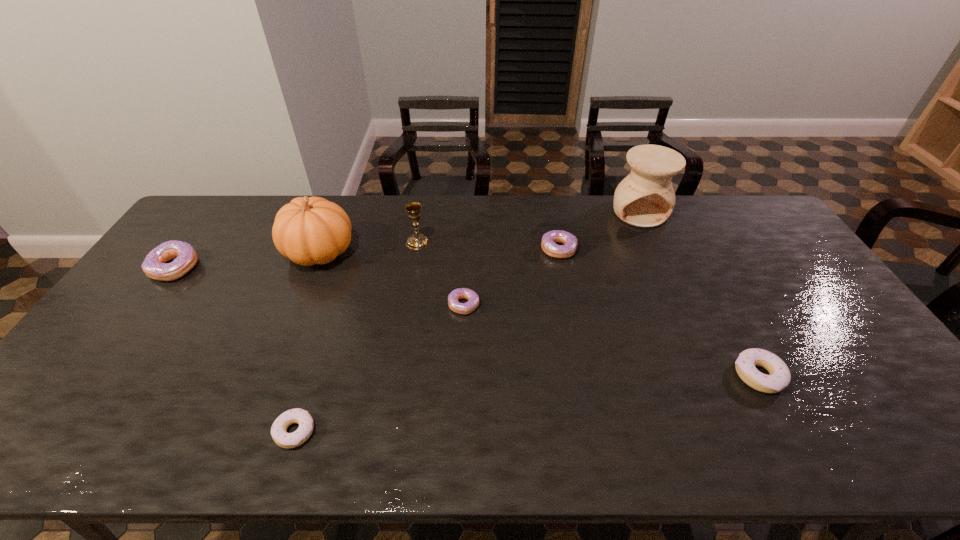
This screenshot has height=540, width=960. I want to click on the bigger white doughnut, so click(x=779, y=378).

Identify the location of the second purple doughnut from left to right. point(463,293).

You are a GUI agent. You are given a task and a screenshot of the screen. Output one action in this format:
    pyautogui.click(x=<x>, y=<y>)
    Task: Click on the third nearest object
    Image resolution: width=960 pixels, height=540 pixels.
    Given the screenshot: What is the action you would take?
    pyautogui.click(x=463, y=293)

At what (x,y) coordinates should I click in order to perform the action: click on the nearest object. Please return your answer as a coordinate pair (x, y). Image resolution: width=960 pixels, height=540 pixels. Looking at the image, I should click on (279, 433).

The width and height of the screenshot is (960, 540). What are the coordinates of `the nearest doughnut` in the screenshot? It's located at (279, 433).

This screenshot has height=540, width=960. Identify the location of vacant region located at the open side of the cream pottery. (674, 291).

Find the location of `free space located on the front of the pumpkin`. free space located on the front of the pumpkin is located at coordinates (298, 306).

Identify the location of blank space located on the left of the chalice. Image resolution: width=960 pixels, height=540 pixels. (328, 242).

Find the location of a particular element. vacant area situated on the right of the biggest purple doughnut is located at coordinates pos(296,268).

Where is `vacant space located 0.370m on the front of the third object from right to left`? This screenshot has width=960, height=540. vacant space located 0.370m on the front of the third object from right to left is located at coordinates (580, 355).